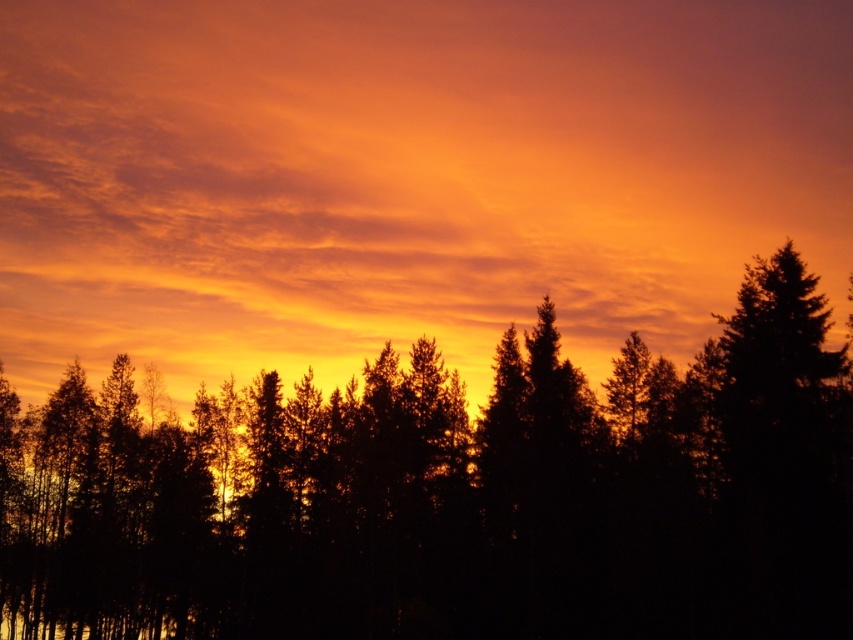
You are planning to install a small weather station between the orange matte cloud at upper center and the black silhouetted trees at center. The station requires a minimum of 50 feet of space between them to function properly. Can the weather station be placed there?

The orange matte cloud at upper center is 66.43 feet from the black silhouetted trees at center, so yes, the weather station can be placed there because the distance between them exceeds the required 50 feet.

You are an artist trying to paint the sunset scene. You want to ensure the orange matte cloud at upper center and the black silhouetted trees at center are proportionally accurate. Based on their widths, which object should you paint wider?

The orange matte cloud at upper center should be painted wider than the black silhouetted trees at center because the description states it might be wider.

You are an astronomer observing the sunset scene. You notice a point in the sky at coordinates point (404, 177). What object is located at that point?

The orange matte cloud at upper center is located at point (404, 177).